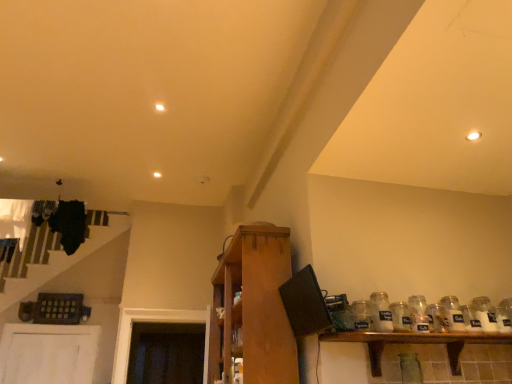
Question: Should I look upward or downward to see clear glass jar at right, placed as the second glass jar when sorted from right to left?

Choices:
 (A) up
 (B) down

Answer: (B)

Question: Is wooden shelf at lower right, the 2th shelf positioned from the left, to the right of clear glass jar at right, placed as the second glass bottle when sorted from right to left, from the viewer's perspective?

Choices:
 (A) yes
 (B) no

Answer: (B)

Question: Considering the relative positions of wooden shelf at lower right, the 1th shelf in the right-to-left sequence, and clear glass jar at right, placed as the second glass bottle when sorted from right to left, in the image provided, is wooden shelf at lower right, the 1th shelf in the right-to-left sequence, behind clear glass jar at right, placed as the second glass bottle when sorted from right to left,?

Choices:
 (A) no
 (B) yes

Answer: (A)

Question: Is wooden shelf at lower right, the 1th shelf in the right-to-left sequence, bigger than clear glass jar at right, which is counted as the 2th glass bottle, starting from the left?

Choices:
 (A) yes
 (B) no

Answer: (A)

Question: Is wooden shelf at lower right, the 1th shelf in the right-to-left sequence, touching clear glass jar at right, which is counted as the 2th glass bottle, starting from the left?

Choices:
 (A) yes
 (B) no

Answer: (B)

Question: From a real-world perspective, is wooden shelf at lower right, the 1th shelf in the right-to-left sequence, below clear glass jar at right, which is counted as the 2th glass bottle, starting from the left?

Choices:
 (A) yes
 (B) no

Answer: (A)

Question: Can you confirm if wooden shelf at lower right, the 2th shelf positioned from the left, is wider than clear glass jar at right, which is counted as the 2th glass bottle, starting from the left?

Choices:
 (A) no
 (B) yes

Answer: (B)

Question: Does wooden cabinet at center, positioned as the second shelf in right-to-left order, appear on the left side of white glass jar at right, marked as the fourth glass jar in a left-to-right arrangement?

Choices:
 (A) no
 (B) yes

Answer: (B)

Question: Is wooden cabinet at center, positioned as the second shelf in right-to-left order, turned away from white glass jar at right, marked as the fourth glass jar in a left-to-right arrangement?

Choices:
 (A) no
 (B) yes

Answer: (B)

Question: From the image's perspective, is wooden cabinet at center, positioned as the second shelf in right-to-left order, above white glass jar at right, marked as the fourth glass jar in a left-to-right arrangement?

Choices:
 (A) yes
 (B) no

Answer: (B)

Question: Considering the relative positions of wooden cabinet at center, which ranks as the first shelf in left-to-right order, and white glass jar at right, marked as the fourth glass jar in a left-to-right arrangement, in the image provided, is wooden cabinet at center, which ranks as the first shelf in left-to-right order, in front of white glass jar at right, marked as the fourth glass jar in a left-to-right arrangement,?

Choices:
 (A) yes
 (B) no

Answer: (A)

Question: Would you say wooden cabinet at center, which ranks as the first shelf in left-to-right order, is outside white glass jar at right, the first glass jar positioned from the right?

Choices:
 (A) yes
 (B) no

Answer: (A)

Question: Is the position of wooden cabinet at center, which ranks as the first shelf in left-to-right order, more distant than that of white glass jar at right, marked as the fourth glass jar in a left-to-right arrangement?

Choices:
 (A) no
 (B) yes

Answer: (A)

Question: Is clear glass jar at shelf right, which is the 4th glass jar in right-to-left order, to the right of clear glass jar at right, which is counted as the 2th glass bottle, starting from the left, from the viewer's perspective?

Choices:
 (A) no
 (B) yes

Answer: (A)